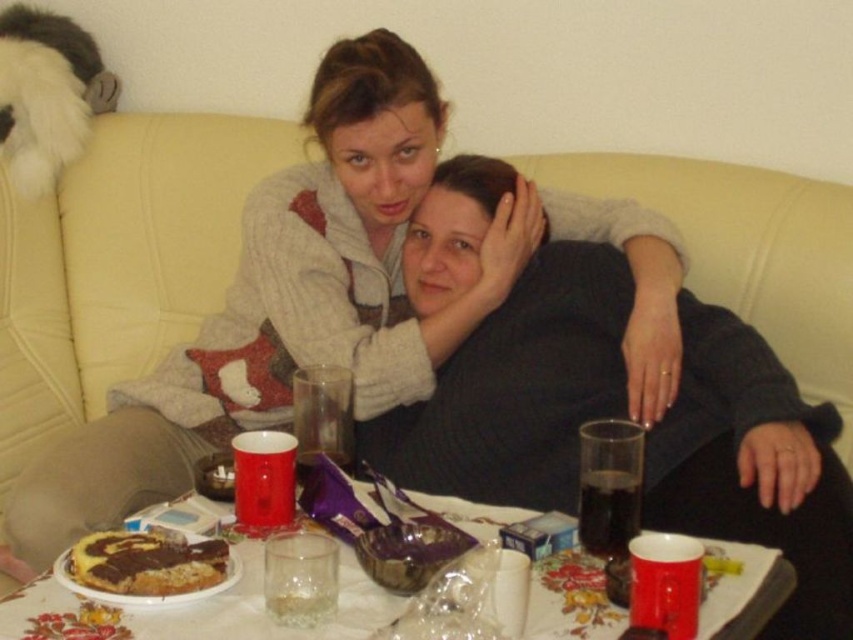
Does matte glass cup at center appear under translucent glass mug at lower center?

No.

Does matte glass cup at center appear over translucent glass mug at lower center?

Yes, matte glass cup at center is above translucent glass mug at lower center.

At what (x,y) coordinates should I click in order to perform the action: click on matte glass cup at center. Please return your answer as a coordinate pair (x, y). Looking at the image, I should click on (518, 387).

The height and width of the screenshot is (640, 853). In order to click on matte glass cup at center in this screenshot , I will do `click(518, 387)`.

Is matte glass cup at center above chocolate cake at lower left?

Yes.

Who is shorter, matte glass cup at center or chocolate cake at lower left?

With less height is chocolate cake at lower left.

Measure the distance between matte glass cup at center and camera.

matte glass cup at center is 3.43 feet from camera.

You are a GUI agent. You are given a task and a screenshot of the screen. Output one action in this format:
    pyautogui.click(x=<x>, y=<y>)
    Task: Click on the matte glass cup at center
    The height and width of the screenshot is (640, 853).
    Given the screenshot: What is the action you would take?
    pyautogui.click(x=518, y=387)

Does translucent glass mug at lower center come in front of chocolate cake at lower left?

Yes, translucent glass mug at lower center is in front of chocolate cake at lower left.

Is translucent glass mug at lower center thinner than chocolate cake at lower left?

No, translucent glass mug at lower center is not thinner than chocolate cake at lower left.

I want to click on translucent glass mug at lower center, so click(264, 609).